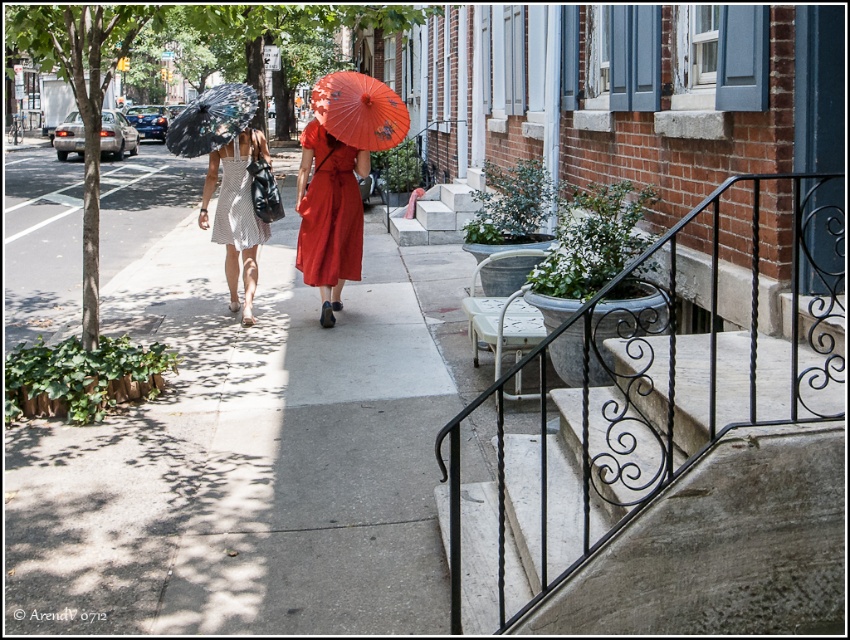
Does matte red dress at center have a greater height compared to matte red parasol at center?

Indeed, matte red dress at center has a greater height compared to matte red parasol at center.

Is matte red dress at center to the right of matte red parasol at center from the viewer's perspective?

In fact, matte red dress at center is to the left of matte red parasol at center.

Between point (341, 160) and point (349, 106), which one is positioned behind?

The point (341, 160) is more distant.

Find the location of a particular element. The height and width of the screenshot is (640, 850). matte red dress at center is located at coordinates (329, 212).

Does matte red parasol at center have a lesser height compared to shiny black umbrella at center?

Correct, matte red parasol at center is not as tall as shiny black umbrella at center.

Is point (318, 84) less distant than point (187, 108)?

Yes, point (318, 84) is closer to viewer.

Where is `matte red parasol at center`? matte red parasol at center is located at coordinates (360, 109).

Can you confirm if gray concrete sidewalk at center is positioned below shiny black umbrella at center?

Yes.

Who is positioned more to the right, gray concrete sidewalk at center or shiny black umbrella at center?

gray concrete sidewalk at center

Which is behind, point (110, 616) or point (224, 122)?

The point (224, 122) is more distant.

You are a GUI agent. You are given a task and a screenshot of the screen. Output one action in this format:
    pyautogui.click(x=<x>, y=<y>)
    Task: Click on the gray concrete sidewalk at center
    
    Given the screenshot: What is the action you would take?
    pyautogui.click(x=241, y=461)